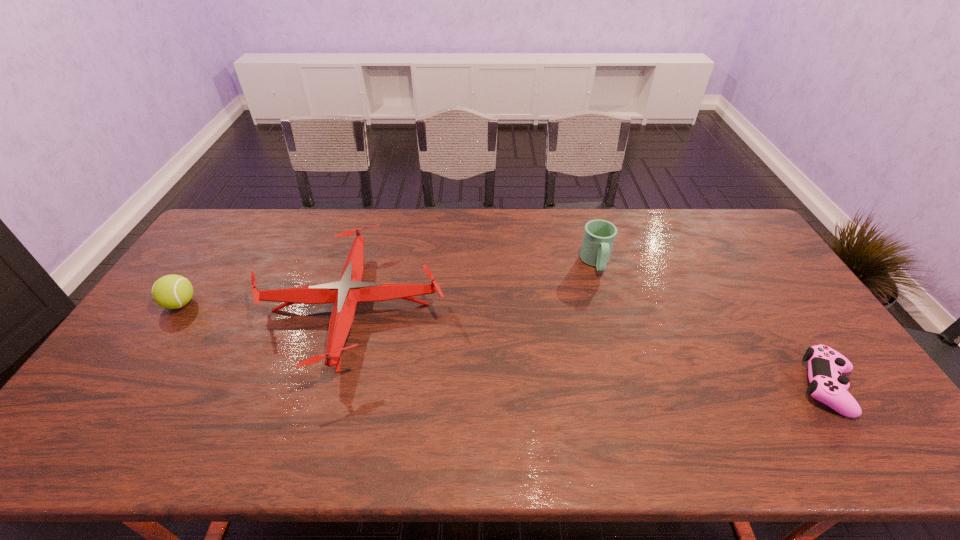
Identify the location of the third object from left to right. (599, 235).

Image resolution: width=960 pixels, height=540 pixels. Identify the location of mug. (x=599, y=235).

This screenshot has height=540, width=960. What are the coordinates of `the third object from right to left` in the screenshot? It's located at (345, 294).

At what (x,y) coordinates should I click in order to perform the action: click on the leftmost object. Please return your answer as a coordinate pair (x, y). Image resolution: width=960 pixels, height=540 pixels. Looking at the image, I should click on (172, 291).

Image resolution: width=960 pixels, height=540 pixels. Find the location of `the rightmost object`. the rightmost object is located at coordinates (825, 365).

Find the location of a particular element. This screenshot has width=960, height=540. the shortest object is located at coordinates (825, 365).

Identify the location of blank area located on the side of the mug with the handle. Image resolution: width=960 pixels, height=540 pixels. (630, 378).

Locate an element on the screen. The image size is (960, 540). vacant space located 0.180m on the front of the drone is located at coordinates (306, 460).

You are a GUI agent. You are given a task and a screenshot of the screen. Output one action in this format:
    pyautogui.click(x=<x>, y=<y>)
    Task: Click on the vacant space situated on the right of the leftmost object
    The image size is (960, 540).
    Given the screenshot: What is the action you would take?
    pyautogui.click(x=276, y=303)

Locate an element on the screen. The width and height of the screenshot is (960, 540). free space located on the back of the control is located at coordinates (748, 266).